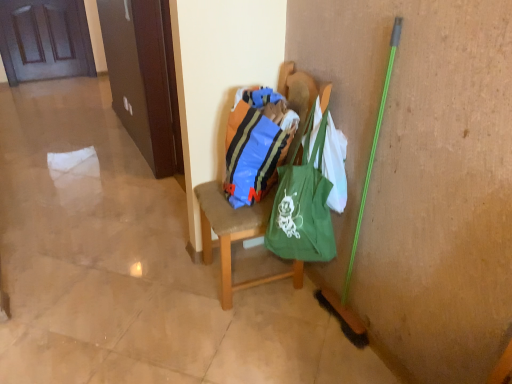
The image size is (512, 384). I want to click on free space in front of wooden chair at center, so click(256, 338).